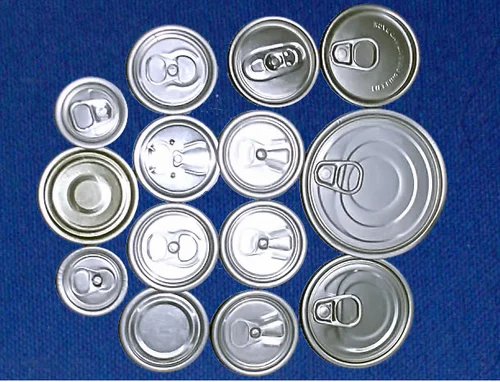
What are the coordinates of `fabric` in the screenshot? It's located at (36, 71).